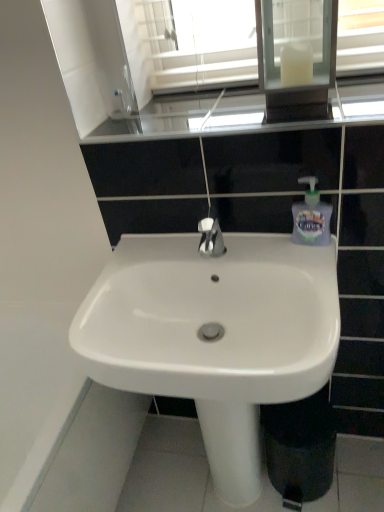
Identify the location of vacant space situated on the left part of translucent plastic soap dispenser at right. The image size is (384, 512). (255, 248).